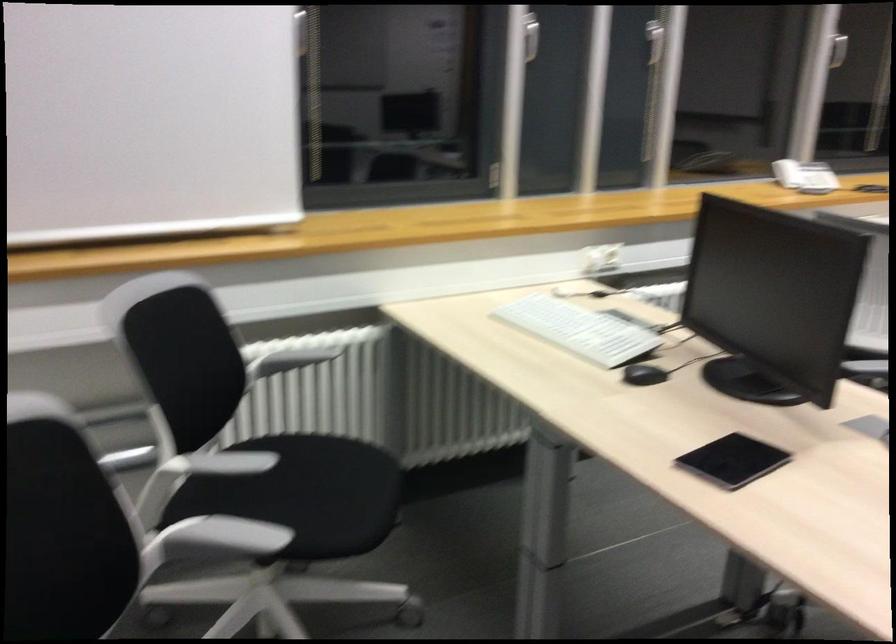
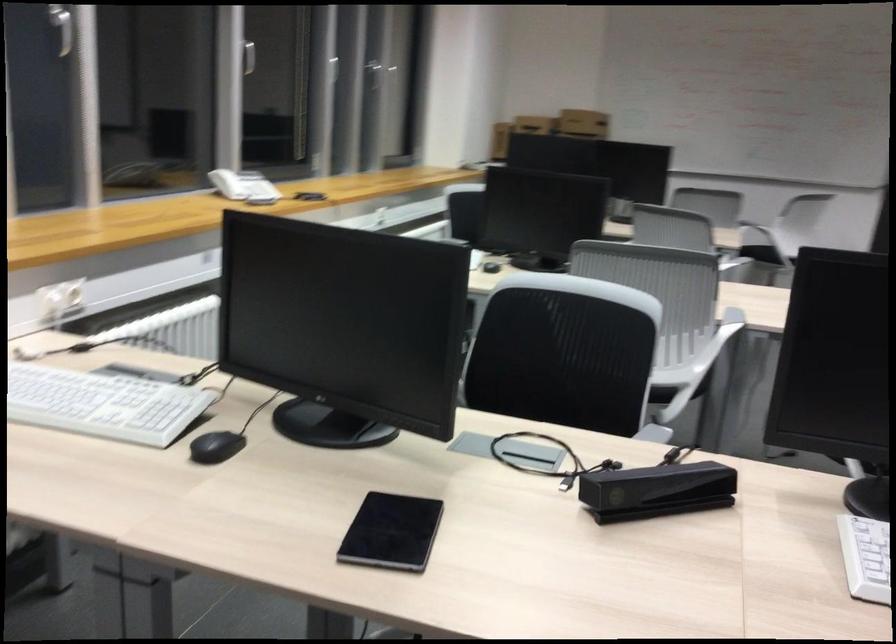
Locate, in the second image, the point that corresponds to point 650,375 in the first image.

(216, 447)